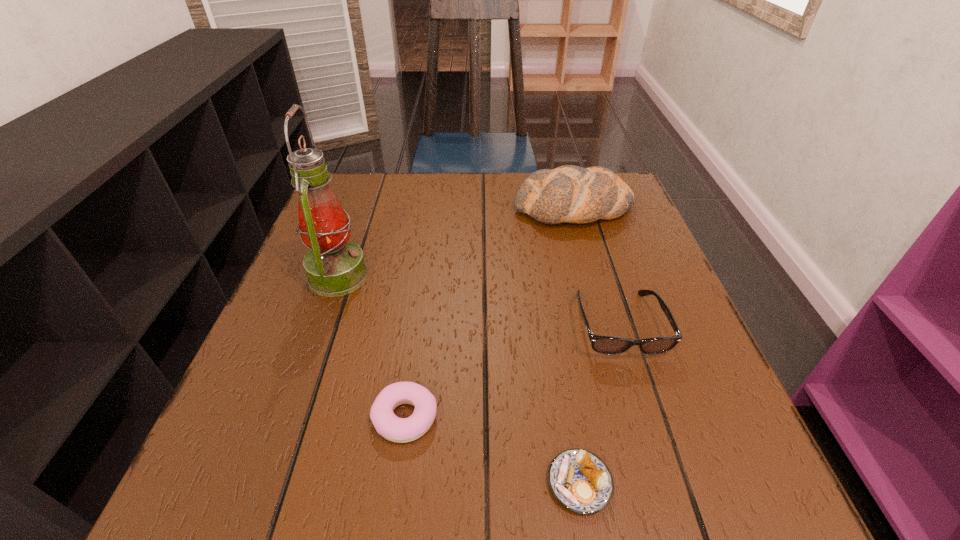
You are a GUI agent. You are given a task and a screenshot of the screen. Output one action in this format:
    pyautogui.click(x=<x>, y=<y>)
    Task: Click on the tallest object
    The image size is (960, 540).
    Given the screenshot: What is the action you would take?
    pyautogui.click(x=335, y=266)

I want to click on oil lamp, so click(335, 266).

Where is `bread`? bread is located at coordinates (572, 194).

I want to click on the farthest object, so click(x=572, y=194).

Where is `spectacles`? spectacles is located at coordinates tap(609, 345).

At what (x,y) coordinates should I click in order to perform the action: click on the second shortest object. Please return your answer as a coordinate pair (x, y). This screenshot has height=540, width=960. Looking at the image, I should click on (401, 430).

Identify the location of the second object from left to right. (401, 430).

Locate an element on the screen. The height and width of the screenshot is (540, 960). the shorter pastry is located at coordinates (579, 480).

The width and height of the screenshot is (960, 540). I want to click on the shortest object, so click(x=579, y=480).

Find the location of a particular element. The width and height of the screenshot is (960, 540). vacant area situated on the right of the tallest object is located at coordinates (534, 276).